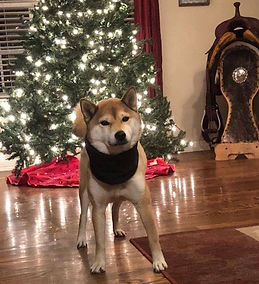
This screenshot has width=259, height=284. I want to click on christmas tree, so click(64, 73).